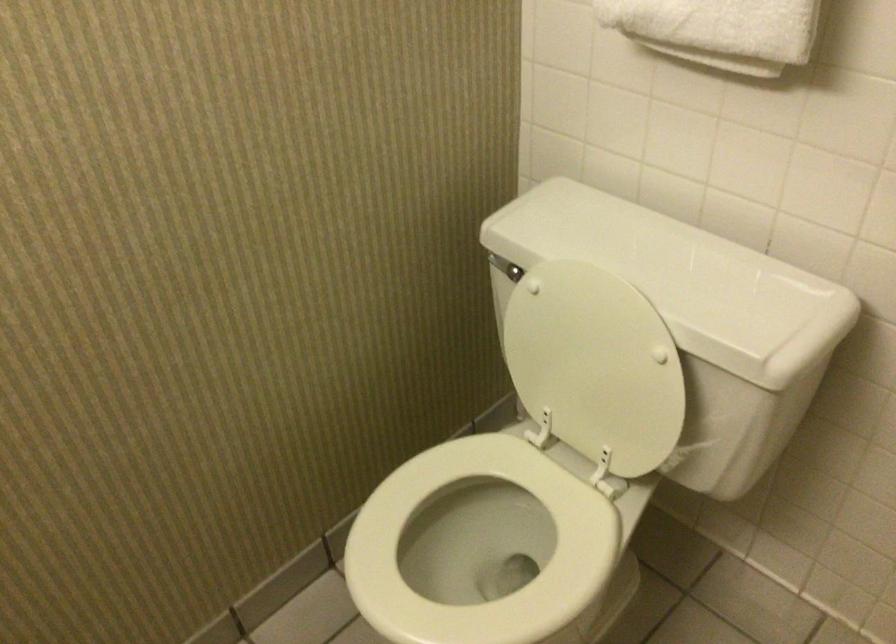
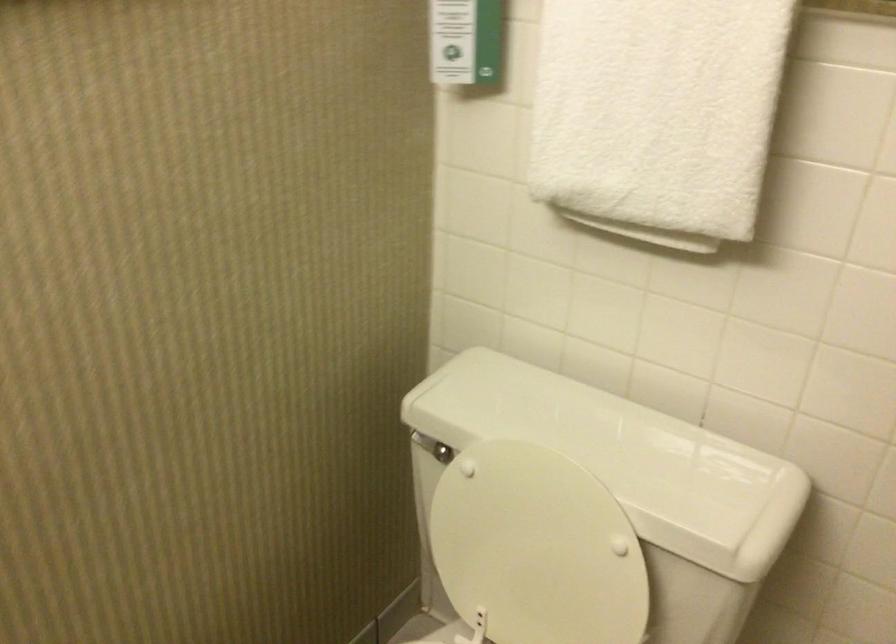
Where in the second image is the point corresponding to (x=591, y=355) from the first image?

(536, 547)